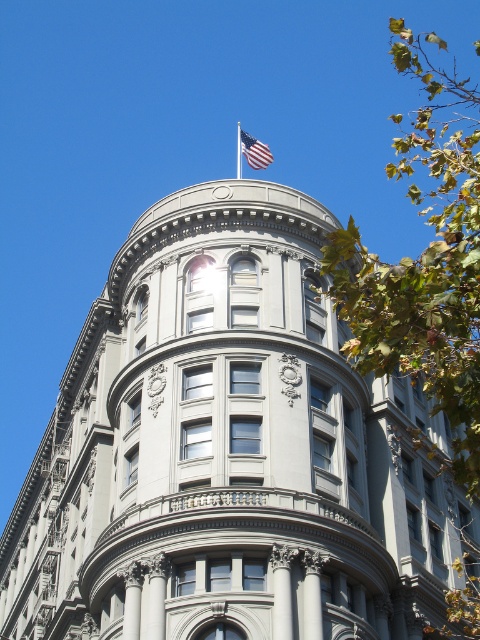
You are standing in front of the classical building and want to determine the spatial relationship between two points marked on the facade. Which point is closer to you, point (256, 156) or point (239, 147)?

Point (256, 156) is closer to the viewer than point (239, 147).

You are standing in front of the classical building and want to hang a new decorative banner. The banner needs to be placed to the left of the silver metallic flag pole at upper center. Is there space available for this, considering the current arrangement with the american flag at top?

The american flag at top is positioned on the right side of the silver metallic flag pole at upper center, so there is space to the left of the silver metallic flag pole at upper center to hang the banner.

You are standing in front of a classical building with a rounded corner. There is a point marked at coordinates (228,451). Based on the scene description, where is this point located?

The point is located on the gray stone tower at center.